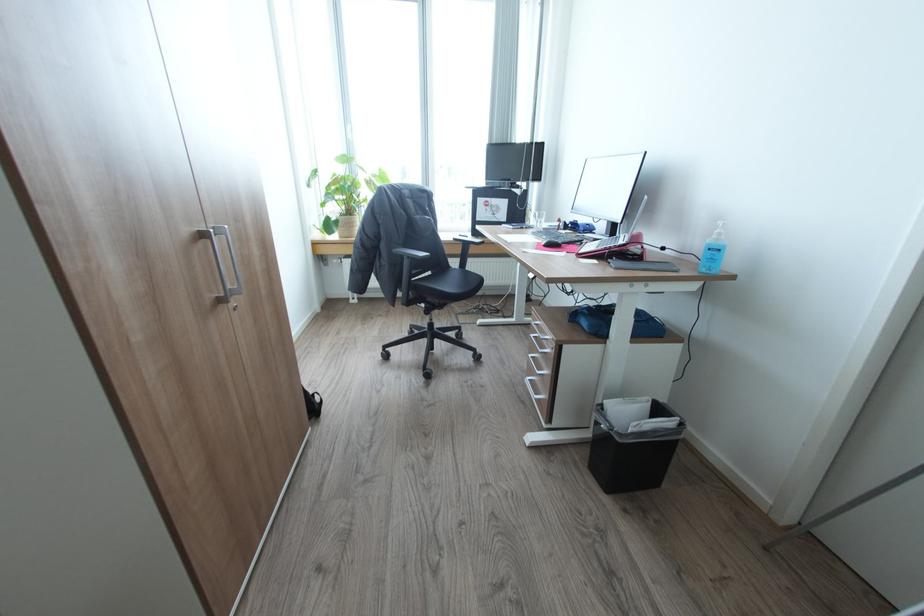
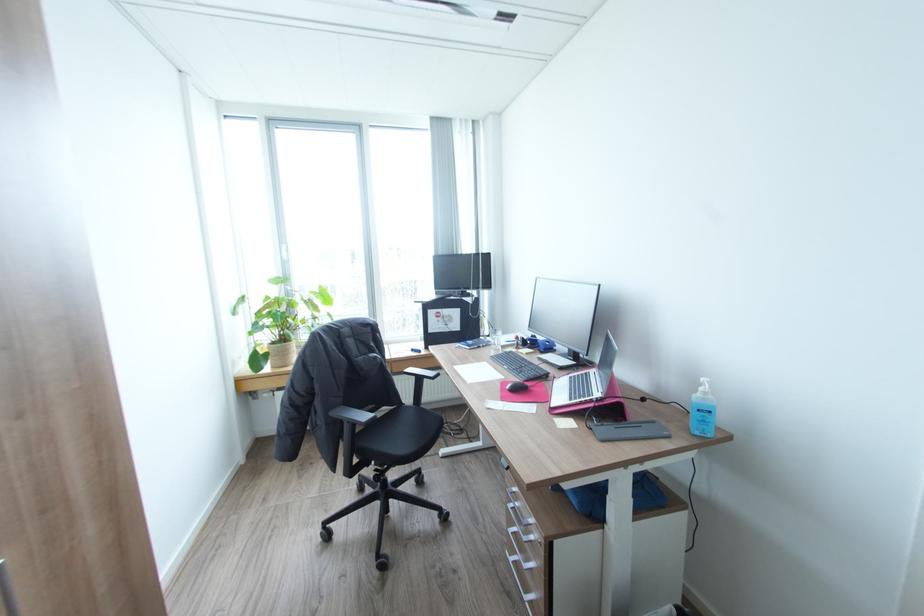
In the second image, find the point that corresponds to point 543,225 in the first image.

(502, 344)